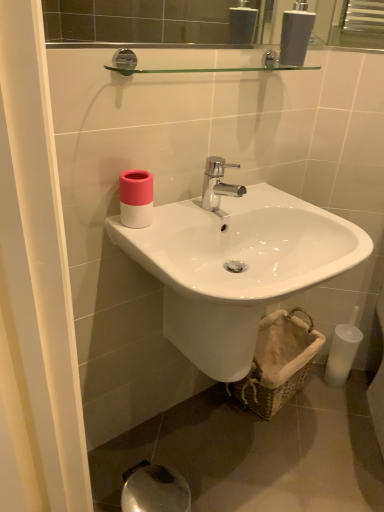
Question: From a real-world perspective, is white glossy sink at center positioned under pink matte cup at upper left based on gravity?

Choices:
 (A) no
 (B) yes

Answer: (B)

Question: Can you confirm if white glossy sink at center is shorter than pink matte cup at upper left?

Choices:
 (A) yes
 (B) no

Answer: (B)

Question: Does white glossy sink at center appear on the left side of pink matte cup at upper left?

Choices:
 (A) no
 (B) yes

Answer: (A)

Question: Is white glossy sink at center positioned with its back to pink matte cup at upper left?

Choices:
 (A) yes
 (B) no

Answer: (B)

Question: Could you tell me if white glossy sink at center is facing pink matte cup at upper left?

Choices:
 (A) no
 (B) yes

Answer: (A)

Question: Is white glossy sink at center thinner than pink matte cup at upper left?

Choices:
 (A) yes
 (B) no

Answer: (B)

Question: Does white glossy soap dispenser at upper center have a lesser width compared to white glossy sink at center?

Choices:
 (A) no
 (B) yes

Answer: (B)

Question: Is white glossy soap dispenser at upper center further to camera compared to white glossy sink at center?

Choices:
 (A) yes
 (B) no

Answer: (A)

Question: Is white glossy soap dispenser at upper center wider than white glossy sink at center?

Choices:
 (A) yes
 (B) no

Answer: (B)

Question: From a real-world perspective, does white glossy soap dispenser at upper center stand above white glossy sink at center?

Choices:
 (A) no
 (B) yes

Answer: (B)

Question: Is there a large distance between white glossy soap dispenser at upper center and white glossy sink at center?

Choices:
 (A) yes
 (B) no

Answer: (B)

Question: Can you confirm if white glossy soap dispenser at upper center is smaller than white glossy sink at center?

Choices:
 (A) yes
 (B) no

Answer: (A)

Question: Does white glossy sink at center lie behind white glossy soap dispenser at upper center?

Choices:
 (A) yes
 (B) no

Answer: (B)